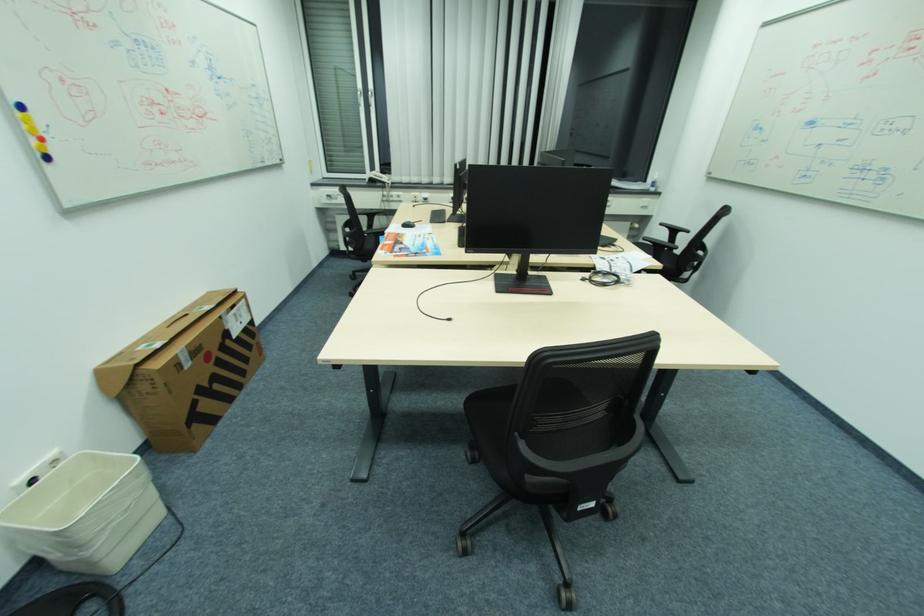
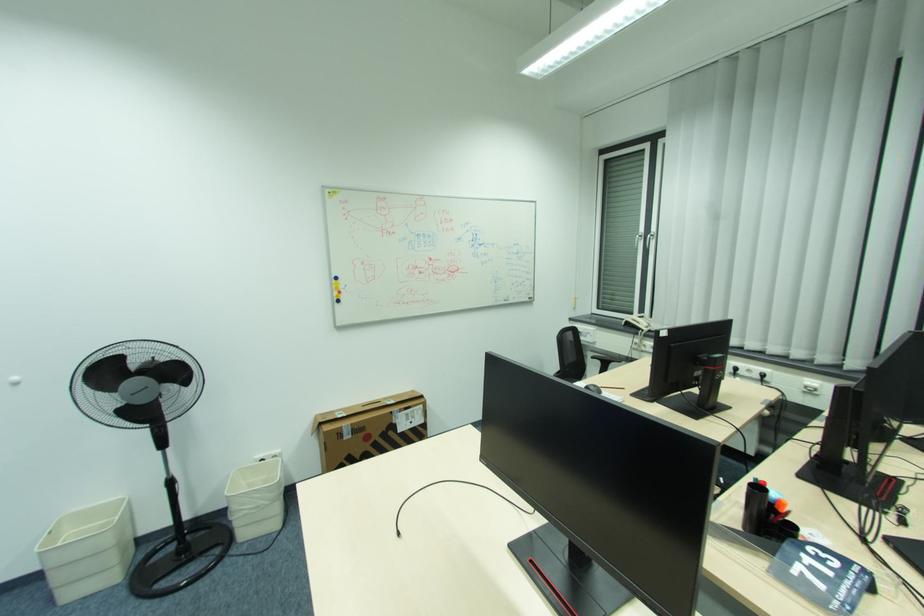
Locate, in the second image, the point that corresponds to point (37, 140) in the first image.

(341, 294)